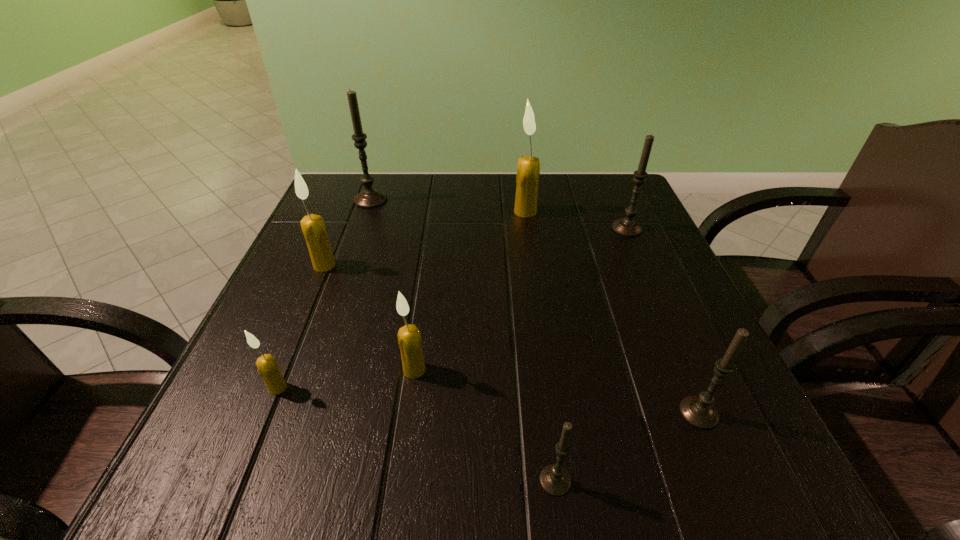
The image size is (960, 540). Find the location of `the farthest cream candle`. the farthest cream candle is located at coordinates (528, 170).

Identify the location of the biggest cream candle. Image resolution: width=960 pixels, height=540 pixels. pyautogui.click(x=528, y=170).

Locate an element on the screen. Image resolution: width=960 pixels, height=540 pixels. the leftmost gray candle is located at coordinates (369, 198).

Find the location of a particular element. Image resolution: width=960 pixels, height=540 pixels. the biggest gray candle is located at coordinates point(369,198).

The height and width of the screenshot is (540, 960). In order to click on the third nearest gray candle in this screenshot , I will do `click(627, 226)`.

What are the coordinates of `the sixth nearest object` in the screenshot? It's located at (627, 226).

Image resolution: width=960 pixels, height=540 pixels. What are the coordinates of `the fourth farthest candle` in the screenshot? It's located at (313, 226).

Find the location of a particular element. This screenshot has height=540, width=960. the second farthest cream candle is located at coordinates (313, 226).

Identify the location of the third farthest cream candle. The width and height of the screenshot is (960, 540). (409, 337).

The image size is (960, 540). What are the coordinates of `the second smallest cream candle` in the screenshot? It's located at (409, 337).